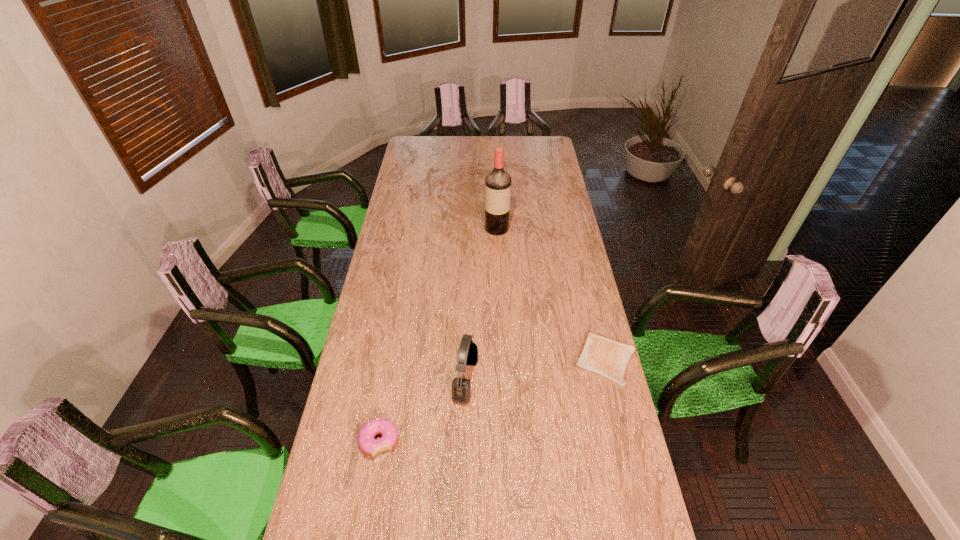
Locate an element on the screen. The image size is (960, 540). vacant space at the left edge of the desktop is located at coordinates (384, 410).

What are the coordinates of `vacant space at the right edge` in the screenshot? It's located at (599, 403).

In the image, there is a desktop. At what (x,y) coordinates should I click in order to perform the action: click on vacant space at the near left corner. Please return your answer as a coordinate pair (x, y). Looking at the image, I should click on (352, 490).

Find the location of a particular element. The image size is (960, 540). free area in between the farthest object and the third object from right to left is located at coordinates (481, 304).

Image resolution: width=960 pixels, height=540 pixels. In order to click on free space between the liquor and the shortest object in this screenshot , I will do (551, 294).

Locate an element on the screen. The width and height of the screenshot is (960, 540). vacant space that's between the second tallest object and the leftmost object is located at coordinates (422, 410).

You are a GUI agent. You are given a task and a screenshot of the screen. Output one action in this format:
    pyautogui.click(x=<x>, y=<y>)
    Task: Click on the blank region between the toast and the leftmost object
    
    Given the screenshot: What is the action you would take?
    pyautogui.click(x=492, y=400)

Find the location of a particular element. Image resolution: width=960 pixels, height=540 pixels. vacant area between the third tallest object and the toast is located at coordinates (492, 400).

I want to click on vacant space that's between the farthest object and the toast, so click(x=551, y=294).

I want to click on vacant space that is in between the shortest object and the farthest object, so click(551, 294).